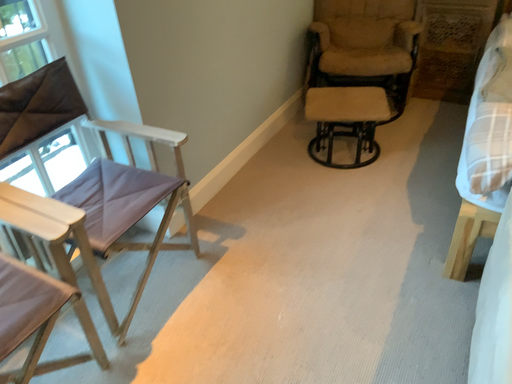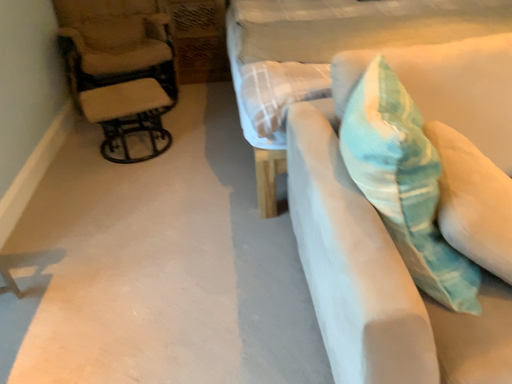
Question: Which way did the camera rotate in the video?

Choices:
 (A) rotated left
 (B) rotated right

Answer: (B)